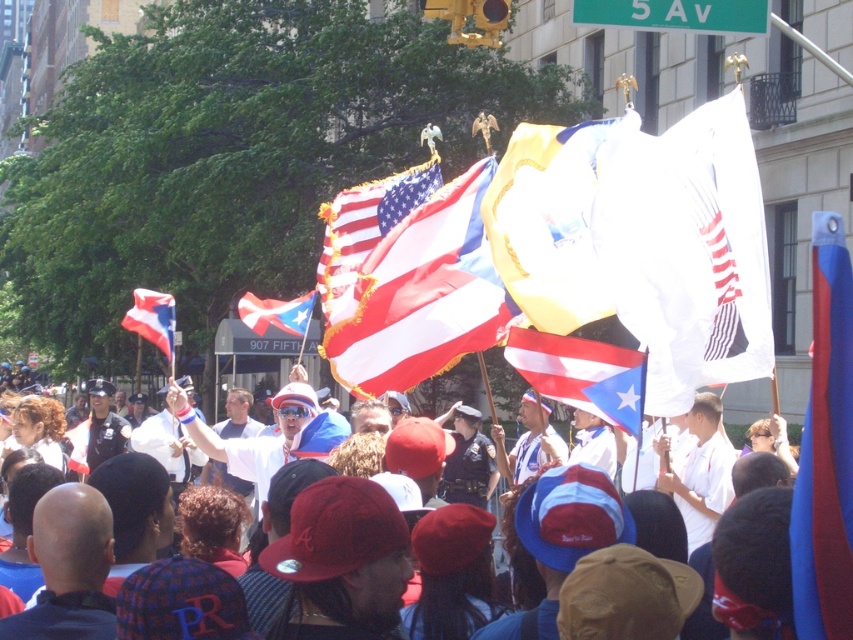
Question: Observing the image, what is the correct spatial positioning of yellow satin flag at center in reference to matte red-white-blue flag at center?

Choices:
 (A) right
 (B) left

Answer: (B)

Question: Among these objects, which one is farthest from the camera?

Choices:
 (A) matte red-white-blue flag at center
 (B) matte american flag at center

Answer: (B)

Question: Based on their relative distances, which object is nearer to the blue/red striped flag at right?

Choices:
 (A) white fabric flag at upper center
 (B) matte fabric flag at center
 (C) green metal street sign at upper center

Answer: (A)

Question: Which object is closer to the camera taking this photo?

Choices:
 (A) red and white striped flag at center
 (B) white fabric flag at upper center
 (C) matte american flag at center

Answer: (B)

Question: Can you confirm if matte fabric flag at center is bigger than green metal street sign at upper center?

Choices:
 (A) no
 (B) yes

Answer: (A)

Question: Is matte fabric flag at center wider than red and white striped flag at center?

Choices:
 (A) yes
 (B) no

Answer: (B)